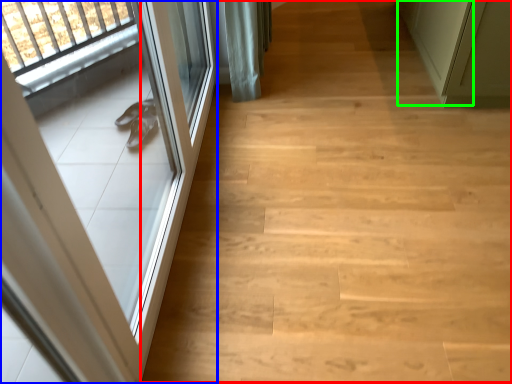
Question: Considering the real-world distances, which object is farthest from stairwell (highlighted by a red box)? door (highlighted by a blue box) or door (highlighted by a green box)?

Choices:
 (A) door
 (B) door

Answer: (B)